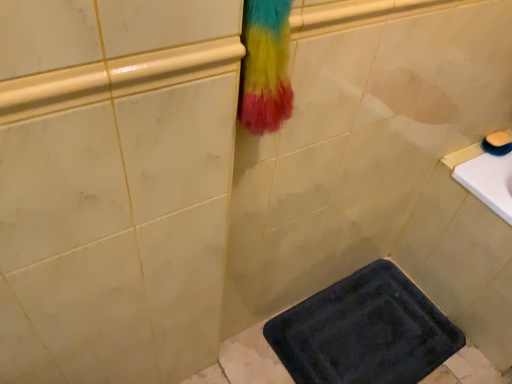
Question: Does smooth yellow soap at upper right have a larger size compared to dark blue textured bath mat at lower center?

Choices:
 (A) yes
 (B) no

Answer: (B)

Question: From a real-world perspective, is smooth yellow soap at upper right below dark blue textured bath mat at lower center?

Choices:
 (A) yes
 (B) no

Answer: (B)

Question: Can you confirm if smooth yellow soap at upper right is smaller than dark blue textured bath mat at lower center?

Choices:
 (A) no
 (B) yes

Answer: (B)

Question: Are smooth yellow soap at upper right and dark blue textured bath mat at lower center beside each other?

Choices:
 (A) no
 (B) yes

Answer: (A)

Question: From the image's perspective, is smooth yellow soap at upper right on dark blue textured bath mat at lower center?

Choices:
 (A) no
 (B) yes

Answer: (B)

Question: Is smooth yellow soap at upper right further to the viewer compared to dark blue textured bath mat at lower center?

Choices:
 (A) no
 (B) yes

Answer: (B)

Question: Could you tell me if dark blue textured bath mat at lower center is turned towards smooth yellow soap at upper right?

Choices:
 (A) no
 (B) yes

Answer: (A)

Question: Can you confirm if dark blue textured bath mat at lower center is thinner than smooth yellow soap at upper right?

Choices:
 (A) no
 (B) yes

Answer: (A)

Question: Is dark blue textured bath mat at lower center turned away from smooth yellow soap at upper right?

Choices:
 (A) no
 (B) yes

Answer: (A)

Question: From a real-world perspective, is dark blue textured bath mat at lower center positioned under smooth yellow soap at upper right based on gravity?

Choices:
 (A) yes
 (B) no

Answer: (A)

Question: Is dark blue textured bath mat at lower center to the right of smooth yellow soap at upper right from the viewer's perspective?

Choices:
 (A) no
 (B) yes

Answer: (A)

Question: Would you say smooth yellow soap at upper right is part of dark blue textured bath mat at lower center's contents?

Choices:
 (A) no
 (B) yes

Answer: (A)

Question: Visually, is dark blue textured bath mat at lower center positioned to the left or to the right of smooth yellow soap at upper right?

Choices:
 (A) right
 (B) left

Answer: (B)